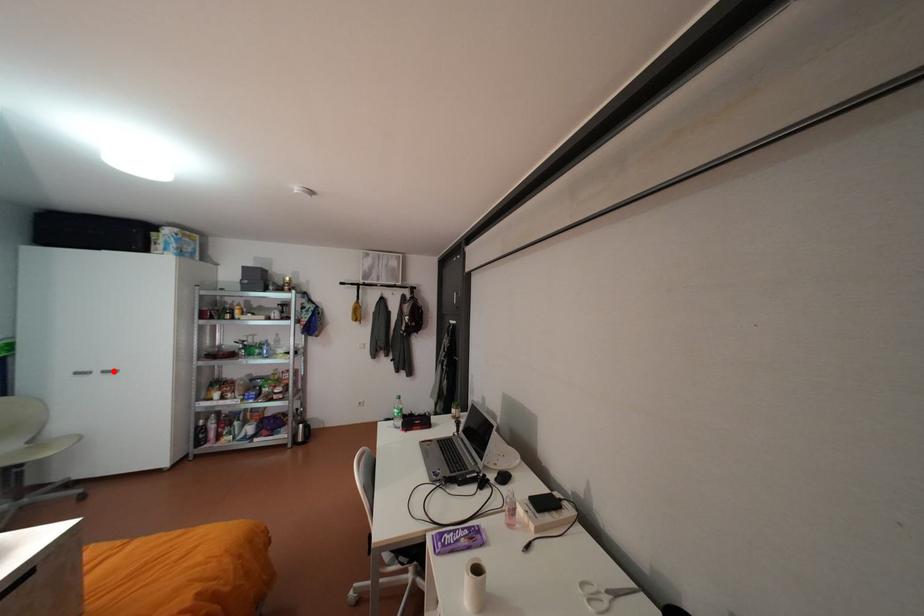
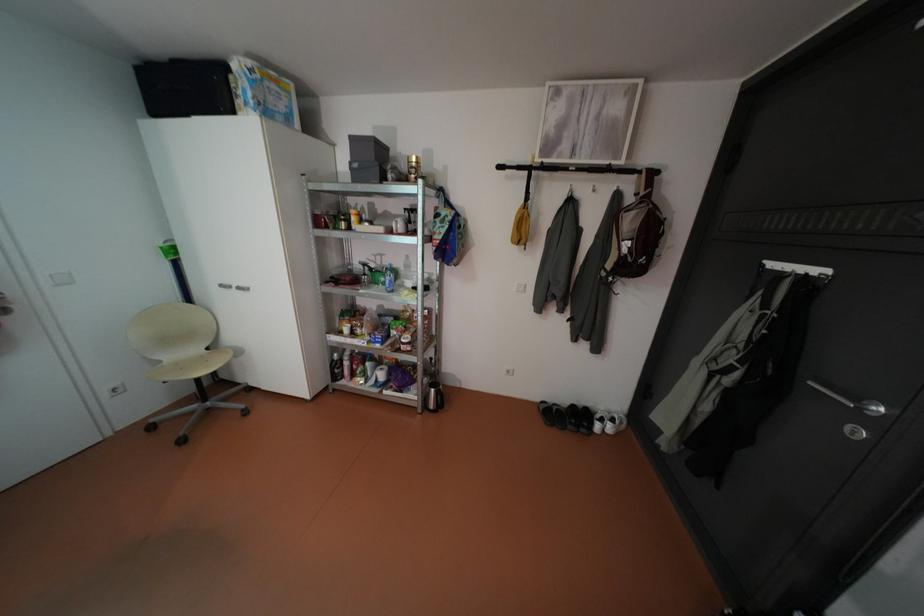
The point at the highlighted location is marked in the first image. Where is the corresponding point in the second image?

(248, 286)